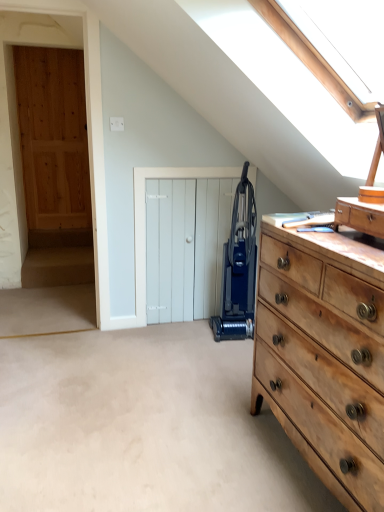
The width and height of the screenshot is (384, 512). What are the coordinates of `free space to the left of blue plastic vacuum cleaner at center` in the screenshot? It's located at (193, 330).